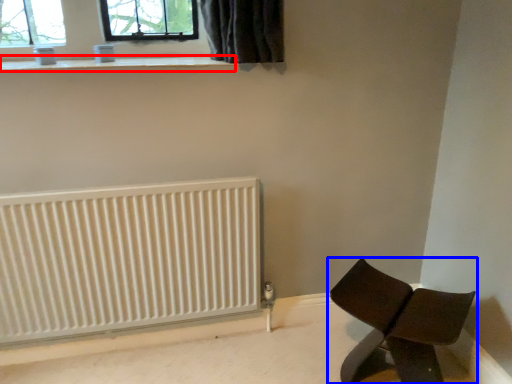
Question: Among these objects, which one is farthest to the camera, window sill (highlighted by a red box) or furniture (highlighted by a blue box)?

Choices:
 (A) window sill
 (B) furniture

Answer: (A)